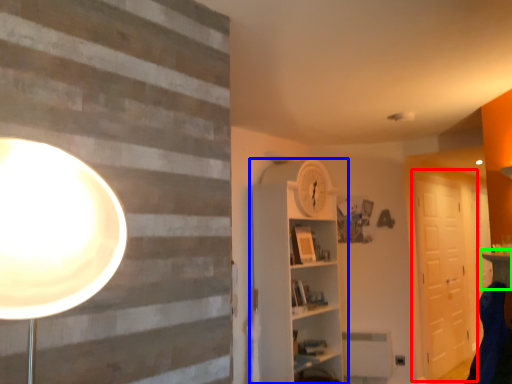
Question: Which object is positioned farthest from barn door (highlighted by a red box)? Select from shelf (highlighted by a blue box) and table (highlighted by a green box).

Choices:
 (A) shelf
 (B) table

Answer: (B)